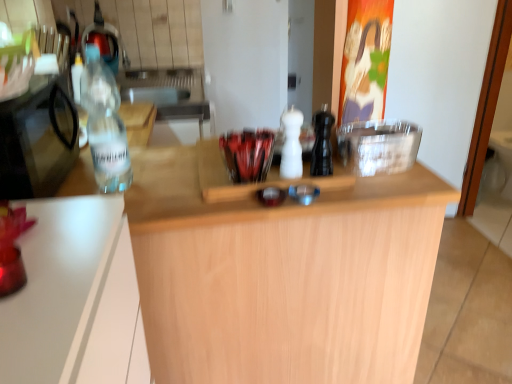
Locate an element on the screen. This screenshot has width=512, height=384. vacant area that lies in front of white matte salt shaker at center, which is the 2th bottle in left-to-right order is located at coordinates [304, 185].